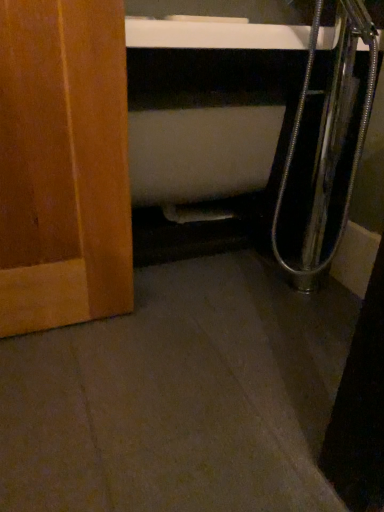
This screenshot has width=384, height=512. What are the coordinates of `metallic silver showerhead at right` in the screenshot? It's located at 330,127.

Describe the element at coordinates (330, 127) in the screenshot. I see `metallic silver showerhead at right` at that location.

Image resolution: width=384 pixels, height=512 pixels. Identify the location of metallic silver showerhead at right. (330, 127).